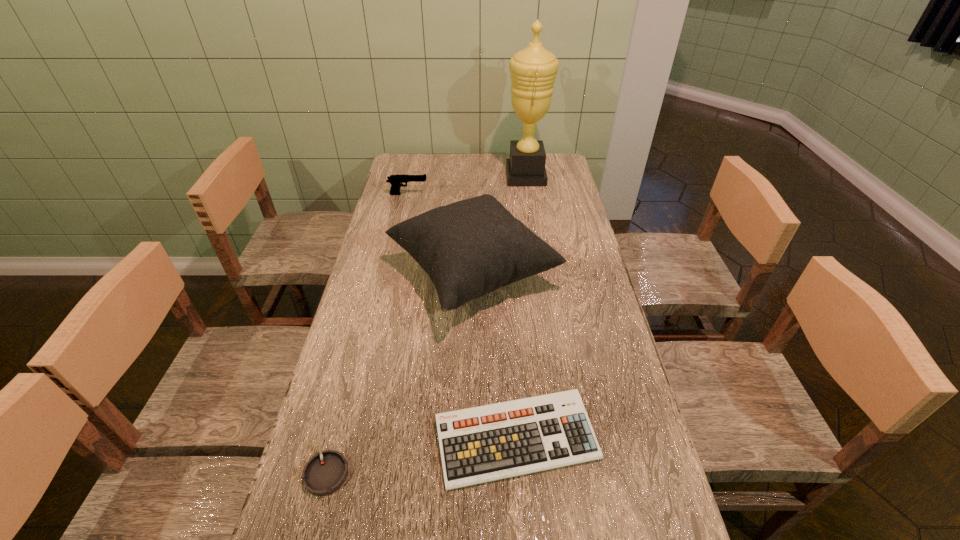
This screenshot has width=960, height=540. I want to click on the tallest object, so click(x=533, y=70).

What are the coordinates of `trophy cup` in the screenshot? It's located at (533, 70).

The image size is (960, 540). Identify the location of cushion. (x=471, y=247).

At what (x,y) coordinates should I click in order to perform the action: click on the third farthest object. Please return your answer as a coordinate pair (x, y). This screenshot has height=540, width=960. Looking at the image, I should click on (471, 247).

Where is `the fourth nearest object`? Image resolution: width=960 pixels, height=540 pixels. the fourth nearest object is located at coordinates (396, 181).

Locate an element on the screen. The image size is (960, 540). the third shortest object is located at coordinates (396, 181).

In order to click on computer keyboard in this screenshot , I will do `click(491, 442)`.

The height and width of the screenshot is (540, 960). I want to click on the shortest object, so click(325, 472).

Identify the location of vacant space located at the front of the trophy cup with handles. (445, 176).

Locate an element on the screen. The width and height of the screenshot is (960, 540). free spot located at the front of the trophy cup with handles is located at coordinates (445, 176).